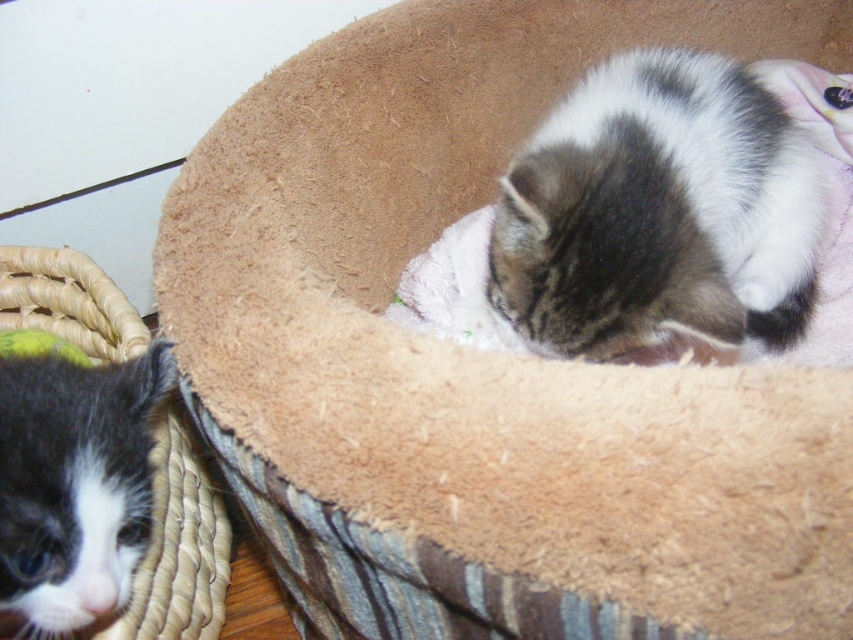
You are a photographer trying to capture both the tabby fur cat at upper right and the black and white fur at left in a single frame. Based on their positions, which direction should you move your camera to include both kittens in the shot?

Since the tabby fur cat at upper right is to the right of the black and white fur at left, you should move your camera to the left to include both kittens in the shot.

Looking at this image, you are a photographer trying to capture both kittens in a single shot. Based on their positions, which point should you focus on first to ensure both are in focus? Remember, you can only focus on one point at a time. The points are point (589, 156) and point (172, 362).

You should focus on point (589, 156) first because it is closer to the camera than point (172, 362). This will ensure both points are within the depth of field.